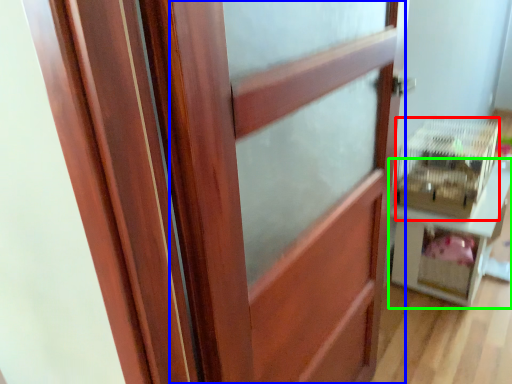
Question: Which object is positioned farthest from crate (highlighted by a red box)? Select from barn door (highlighted by a blue box) and furniture (highlighted by a green box).

Choices:
 (A) barn door
 (B) furniture

Answer: (A)